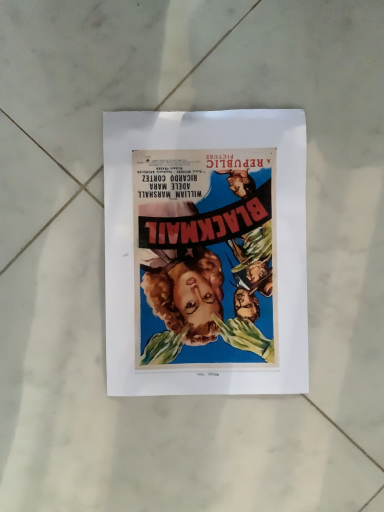
Where is `free location above vibrant paper poster at center (from a real-world perspective)`? The height and width of the screenshot is (512, 384). free location above vibrant paper poster at center (from a real-world perspective) is located at coordinates (208, 249).